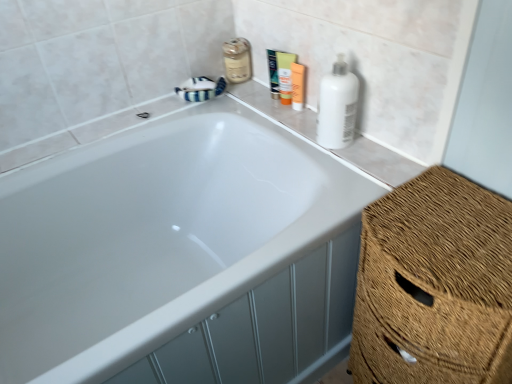
The width and height of the screenshot is (512, 384). In order to click on vacant space situated on the left part of orange matte lotion at upper center, which is the 3th toiletry in left-to-right order in this screenshot , I will do `click(265, 104)`.